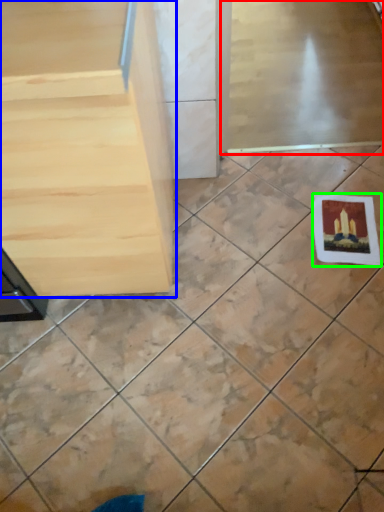
Question: Which object is the closest to the screen door (highlighted by a red box)? Choose among these: furniture (highlighted by a blue box) or postcard (highlighted by a green box).

Choices:
 (A) furniture
 (B) postcard

Answer: (B)